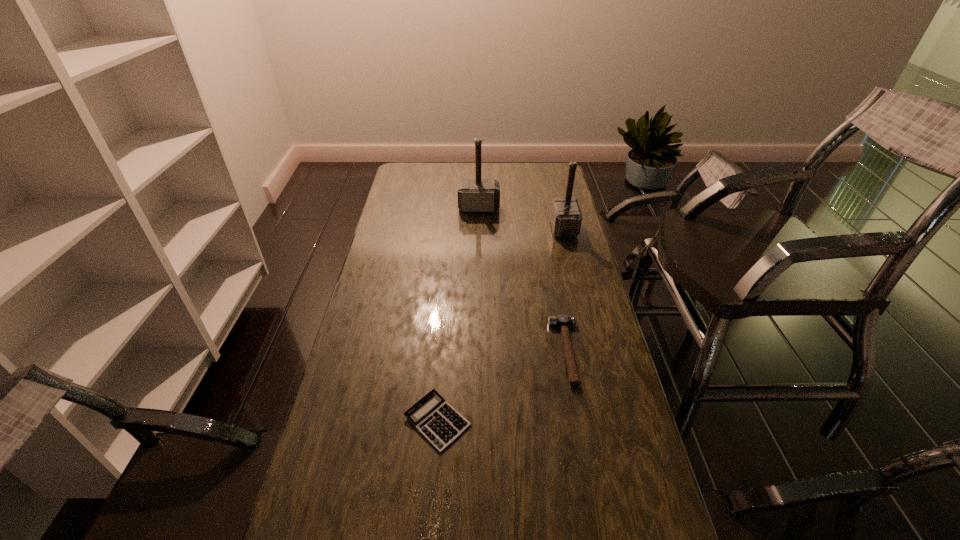
This screenshot has height=540, width=960. I want to click on the farthest hammer, so click(474, 195).

Locate an element on the screen. the leftmost hammer is located at coordinates (474, 195).

You are a GUI agent. You are given a task and a screenshot of the screen. Output one action in this format:
    pyautogui.click(x=<x>, y=<y>)
    Task: Click on the second nearest hammer
    This screenshot has height=540, width=960.
    Given the screenshot: What is the action you would take?
    pyautogui.click(x=566, y=218)

You are a GUI agent. You are given a task and a screenshot of the screen. Output one action in this format:
    pyautogui.click(x=<x>, y=<y>)
    Task: Click on the third tallest object
    
    Given the screenshot: What is the action you would take?
    pyautogui.click(x=563, y=321)

Image resolution: width=960 pixels, height=540 pixels. Identify the location of the second nearest object. (563, 321).

Find the location of `the nearest object`. the nearest object is located at coordinates (440, 424).

I want to click on the shortest object, so click(440, 424).

You are a GUI agent. You are given a task and a screenshot of the screen. Output one action in this format:
    pyautogui.click(x=<x>, y=<y>)
    Task: Click on the vacant region located for striking with the head of the farthest hammer
    
    Given the screenshot: What is the action you would take?
    pyautogui.click(x=479, y=266)

Where is `vacant space located 0.380m on the left of the second farthest hammer`? This screenshot has height=540, width=960. vacant space located 0.380m on the left of the second farthest hammer is located at coordinates (460, 229).

I want to click on free region located on the striking face of the nearest hammer, so click(x=444, y=352).